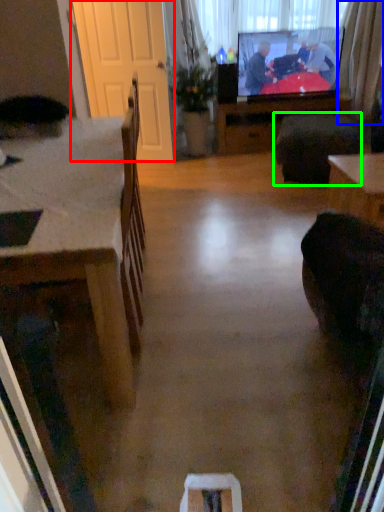
Question: Estimate the real-world distances between objects in this image. Which object is closer to screen door (highlighted by a red box), curtain (highlighted by a blue box) or footrest (highlighted by a green box)?

Choices:
 (A) curtain
 (B) footrest

Answer: (B)